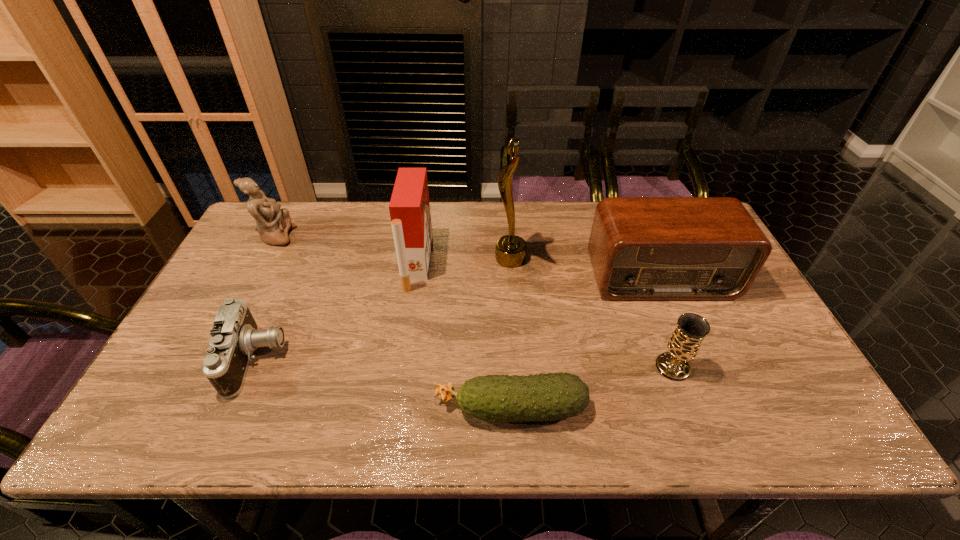
Locate an element on the screen. This screenshot has width=960, height=540. empty space between the radio receiver and the figurine is located at coordinates (468, 256).

I want to click on object identified as the fourth closest to the figurine, so point(541,397).

Where is `the second closest object relative to the figurine`? This screenshot has height=540, width=960. the second closest object relative to the figurine is located at coordinates (409, 207).

Where is `vacant region that satisfies the following two spatial constraints: 1. at the lens of the chalice; 2. on the right side of the camera`? vacant region that satisfies the following two spatial constraints: 1. at the lens of the chalice; 2. on the right side of the camera is located at coordinates (252, 367).

I want to click on vacant space that satisfies the following two spatial constraints: 1. on the back side of the third shortest object; 2. at the lens of the camera, so click(x=670, y=359).

Find the location of a particular element. This screenshot has width=960, height=540. vacant space that satisfies the following two spatial constraints: 1. on the front-facing side of the figurine; 2. on the right side of the chalice is located at coordinates (206, 367).

I want to click on free space that satisfies the following two spatial constraints: 1. on the front-facing side of the fifth tallest object; 2. on the left side of the fifth object from right to left, so click(x=401, y=367).

Where is `vacant position in the image that satisfies the following two spatial constraints: 1. on the front-facing side of the tallest object; 2. on the left side of the chalice`? The width and height of the screenshot is (960, 540). vacant position in the image that satisfies the following two spatial constraints: 1. on the front-facing side of the tallest object; 2. on the left side of the chalice is located at coordinates (518, 367).